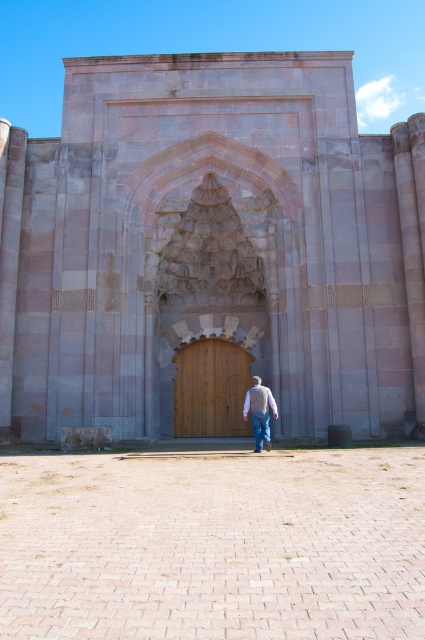
Question: Which point is farther to the camera?

Choices:
 (A) wooden door at center
 (B) light brown sweater at center

Answer: (A)

Question: Estimate the real-world distances between objects in this image. Which object is farther from the light brown sweater at center?

Choices:
 (A) wooden door at center
 (B) blue denim jeans at center

Answer: (A)

Question: Where is light brown sweater at center located in relation to blue denim jeans at center in the image?

Choices:
 (A) below
 (B) above

Answer: (B)

Question: Does light brown sweater at center have a greater width compared to blue denim jeans at center?

Choices:
 (A) no
 (B) yes

Answer: (B)

Question: Which point is closer to the camera?

Choices:
 (A) wooden door at center
 (B) blue denim jeans at center
 (C) light brown sweater at center

Answer: (C)

Question: In this image, where is wooden door at center located relative to blue denim jeans at center?

Choices:
 (A) left
 (B) right

Answer: (A)